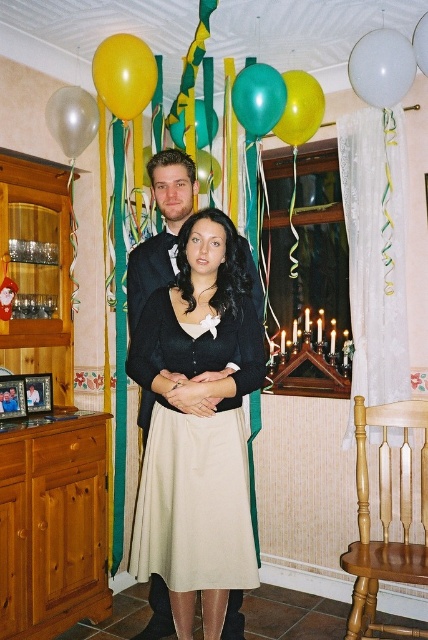
Question: Observing the image, what is the correct spatial positioning of yellow matte balloon at upper left in reference to matte green balloon at center?

Choices:
 (A) right
 (B) left

Answer: (B)

Question: Which object is the farthest from the green glossy balloon at center?

Choices:
 (A) yellow matte balloon at upper left
 (B) matte green balloon at center
 (C) green matte balloon at upper center

Answer: (B)

Question: Which point is farther to the camera?

Choices:
 (A) green matte balloon at upper center
 (B) beige pleated skirt at center
 (C) light brown wooden chair at lower right
 (D) matte green balloon at center

Answer: (A)

Question: Among these points, which one is nearest to the camera?

Choices:
 (A) (241, 81)
 (B) (422, 566)
 (C) (372, 45)
 (D) (422, 65)

Answer: (D)

Question: Is transparent white balloon at upper left to the right of matte green balloon at center from the viewer's perspective?

Choices:
 (A) yes
 (B) no

Answer: (B)

Question: Can you confirm if beige pleated skirt at center is positioned to the right of yellow matte balloon at upper left?

Choices:
 (A) yes
 (B) no

Answer: (A)